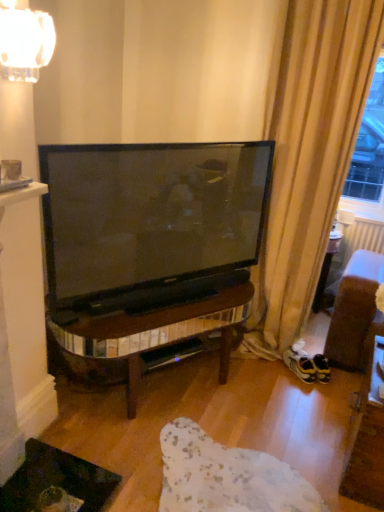
Describe the element at coordinates (308, 154) in the screenshot. I see `beige fabric curtain at right` at that location.

This screenshot has width=384, height=512. What do you see at coordinates (10, 169) in the screenshot? I see `matte white mug at upper left` at bounding box center [10, 169].

The width and height of the screenshot is (384, 512). What are the coordinates of `yellow suede sneakers at lower right` in the screenshot? It's located at (300, 364).

Image resolution: width=384 pixels, height=512 pixels. Find the location of `footwear to the right of clear glass lampshade at upper left`. footwear to the right of clear glass lampshade at upper left is located at coordinates (300, 364).

From the image's perspective, is yellow suede sneakers at lower right below clear glass lampshade at upper left?

Indeed, from the image's perspective, yellow suede sneakers at lower right is shown beneath clear glass lampshade at upper left.

Who is smaller, yellow suede sneakers at lower right or clear glass lampshade at upper left?

yellow suede sneakers at lower right.

Between yellow suede sneakers at lower right and clear glass lampshade at upper left, which one is positioned behind?

yellow suede sneakers at lower right is further from the camera.

Which object is closer to the camera taking this photo, beige fabric curtain at right or yellow suede sneakers at lower right?

Positioned in front is beige fabric curtain at right.

Is beige fabric curtain at right looking in the opposite direction of yellow suede sneakers at lower right?

No, beige fabric curtain at right is not facing away from yellow suede sneakers at lower right.

From the picture: From a real-world perspective, which is physically above, beige fabric curtain at right or yellow suede sneakers at lower right?

beige fabric curtain at right is physically above.

Which is farther, (x=303, y=80) or (x=286, y=353)?

Point (x=286, y=353)

Can we say clear glass lampshade at upper left lies outside beige fabric curtain at right?

That's correct, clear glass lampshade at upper left is outside of beige fabric curtain at right.

Between clear glass lampshade at upper left and beige fabric curtain at right, which one appears on the right side from the viewer's perspective?

beige fabric curtain at right is more to the right.

Is clear glass lampshade at upper left aimed at beige fabric curtain at right?

No, clear glass lampshade at upper left is not oriented towards beige fabric curtain at right.

Considering the sizes of objects clear glass lampshade at upper left and beige fabric curtain at right in the image provided, who is wider, clear glass lampshade at upper left or beige fabric curtain at right?

beige fabric curtain at right is wider.

Consider the image. From their relative heights in the image, would you say beige fabric curtain at right is taller or shorter than clear glass lampshade at upper left?

Clearly, beige fabric curtain at right is taller compared to clear glass lampshade at upper left.

This screenshot has height=512, width=384. Identify the location of lamp in front of the beige fabric curtain at right. (24, 42).

Is beige fabric curtain at right facing towards clear glass lampshade at upper left?

No, beige fabric curtain at right is not facing towards clear glass lampshade at upper left.

From a real-world perspective, is beige fabric curtain at right positioned over matte white mug at upper left based on gravity?

No, from a real-world perspective, beige fabric curtain at right is not above matte white mug at upper left.

Is beige fabric curtain at right thinner than matte white mug at upper left?

Incorrect, the width of beige fabric curtain at right is not less than that of matte white mug at upper left.

Which of these two, beige fabric curtain at right or matte white mug at upper left, is smaller?

Smaller between the two is matte white mug at upper left.

Considering the positions of objects beige fabric curtain at right and matte white mug at upper left in the image provided, who is in front, beige fabric curtain at right or matte white mug at upper left?

Positioned in front is matte white mug at upper left.

In the scene shown: Is yellow suede sneakers at lower right completely or partially outside of matte white mug at upper left?

Yes, yellow suede sneakers at lower right is not within matte white mug at upper left.

Considering the positions of objects yellow suede sneakers at lower right and matte white mug at upper left in the image provided, who is more to the right, yellow suede sneakers at lower right or matte white mug at upper left?

From the viewer's perspective, yellow suede sneakers at lower right appears more on the right side.

Which point is more distant from viewer, (306, 362) or (4, 169)?

Point (306, 362)

How many degrees apart are the facing directions of matte white mug at upper left and beige fabric curtain at right?

The facing directions of matte white mug at upper left and beige fabric curtain at right are 89.7 degrees apart.

From a real-world perspective, is matte white mug at upper left under beige fabric curtain at right?

Actually, matte white mug at upper left is physically above beige fabric curtain at right in the real world.

Is matte white mug at upper left directly adjacent to beige fabric curtain at right?

No, matte white mug at upper left is not touching beige fabric curtain at right.

From the image's perspective, which is above, matte white mug at upper left or beige fabric curtain at right?

beige fabric curtain at right is shown above in the image.

Identify the location of footwear lying on the right of clear glass lampshade at upper left. The width and height of the screenshot is (384, 512). (300, 364).

I want to click on footwear below the beige fabric curtain at right (from the image's perspective), so click(x=300, y=364).

Looking at the image, which one is located further to yellow suede sneakers at lower right, matte white mug at upper left or clear glass lampshade at upper left?

clear glass lampshade at upper left.

Which object lies nearer to the anchor point matte white mug at upper left, yellow suede sneakers at lower right or clear glass lampshade at upper left?

clear glass lampshade at upper left.

From the picture: From the image, which object appears to be nearer to beige fabric curtain at right, yellow suede sneakers at lower right or clear glass lampshade at upper left?

yellow suede sneakers at lower right lies closer to beige fabric curtain at right than the other object.

From the image, which object appears to be farther from beige fabric curtain at right, matte white mug at upper left or yellow suede sneakers at lower right?

Among the two, matte white mug at upper left is located further to beige fabric curtain at right.

Which object lies further to the anchor point matte white mug at upper left, yellow suede sneakers at lower right or beige fabric curtain at right?

yellow suede sneakers at lower right is positioned further to the anchor matte white mug at upper left.

Estimate the real-world distances between objects in this image. Which object is closer to yellow suede sneakers at lower right, clear glass lampshade at upper left or beige fabric curtain at right?

Based on the image, beige fabric curtain at right appears to be nearer to yellow suede sneakers at lower right.

From the image, which object appears to be farther from yellow suede sneakers at lower right, beige fabric curtain at right or clear glass lampshade at upper left?

clear glass lampshade at upper left.

Considering their positions, is yellow suede sneakers at lower right positioned further to beige fabric curtain at right than matte white mug at upper left?

matte white mug at upper left.

Locate an element on the screen. This screenshot has width=384, height=512. coffee cup between clear glass lampshade at upper left and yellow suede sneakers at lower right along the z-axis is located at coordinates (10, 169).

Locate an element on the screen. This screenshot has height=512, width=384. lamp located between matte white mug at upper left and beige fabric curtain at right in the left-right direction is located at coordinates (24, 42).

Identify the location of curtain between clear glass lampshade at upper left and yellow suede sneakers at lower right vertically. (308, 154).

Image resolution: width=384 pixels, height=512 pixels. Find the location of `curtain between matte white mug at upper left and yellow suede sneakers at lower right from left to right`. curtain between matte white mug at upper left and yellow suede sneakers at lower right from left to right is located at coordinates (308, 154).